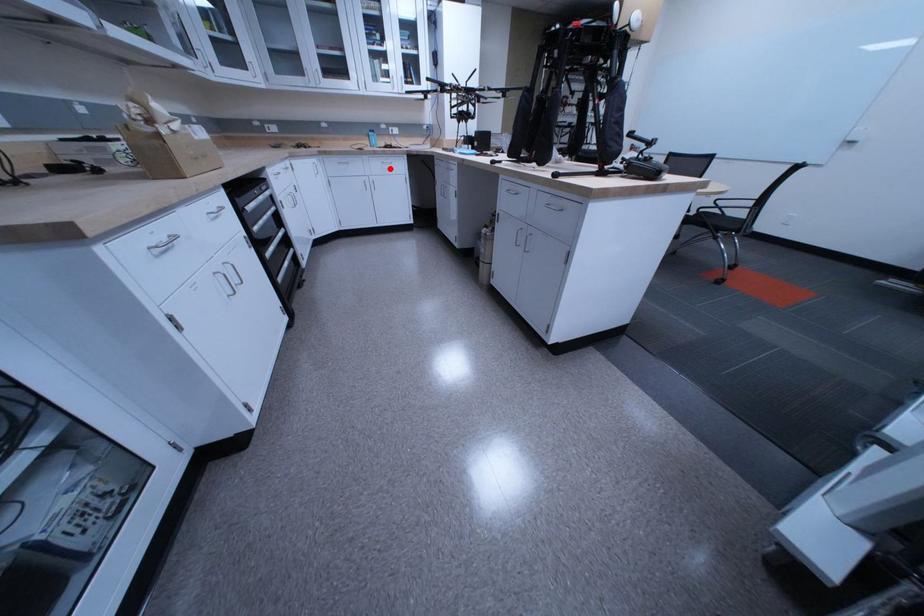
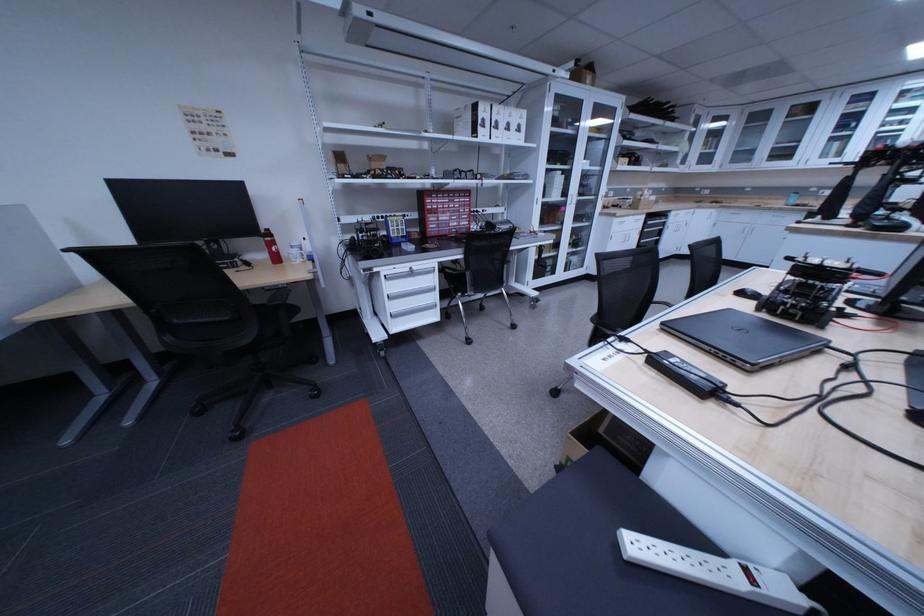
Question: A red point is marked in image1. In image2, is the corresponding 3D point closer to the camera or farther? Reply with the corresponding letter.

Choices:
 (A) The corresponding 3D point is closer.
 (B) The corresponding 3D point is farther.

Answer: (B)